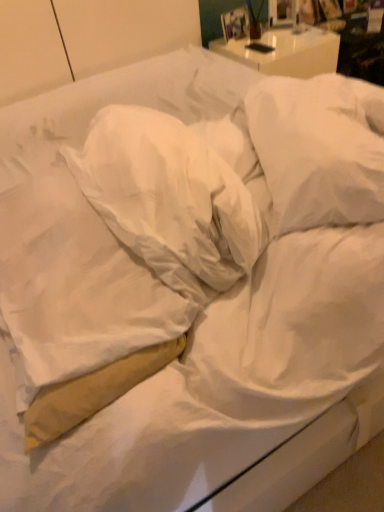
Question: Is tan fabric pillow at left, which ranks as the 1th pillow in left-to-right order, positioned far away from white soft pillow at upper right, which appears as the 1th pillow when viewed from the right?

Choices:
 (A) yes
 (B) no

Answer: (B)

Question: Is white soft pillow at upper right, which appears as the 1th pillow when viewed from the right, at the back of tan fabric pillow at left, which ranks as the 1th pillow in left-to-right order?

Choices:
 (A) no
 (B) yes

Answer: (A)

Question: Is the surface of tan fabric pillow at left, placed as the 3th pillow when sorted from right to left, in direct contact with white soft pillow at upper right, which appears as the 1th pillow when viewed from the right?

Choices:
 (A) yes
 (B) no

Answer: (B)

Question: Does tan fabric pillow at left, placed as the 3th pillow when sorted from right to left, appear on the left side of white soft pillow at upper right, which is the third pillow from left to right?

Choices:
 (A) no
 (B) yes

Answer: (B)

Question: From a real-world perspective, is tan fabric pillow at left, placed as the 3th pillow when sorted from right to left, located higher than white soft pillow at upper right, which appears as the 1th pillow when viewed from the right?

Choices:
 (A) yes
 (B) no

Answer: (B)

Question: From the image's perspective, is white soft pillow at center, which appears as the second pillow when viewed from the left, located above or below tan fabric pillow at left, which ranks as the 1th pillow in left-to-right order?

Choices:
 (A) below
 (B) above

Answer: (B)

Question: From their relative heights in the image, would you say white soft pillow at center, which appears as the second pillow when viewed from the left, is taller or shorter than tan fabric pillow at left, which ranks as the 1th pillow in left-to-right order?

Choices:
 (A) tall
 (B) short

Answer: (A)

Question: From a real-world perspective, is white soft pillow at center, the 2th pillow when ordered from right to left, above or below tan fabric pillow at left, which ranks as the 1th pillow in left-to-right order?

Choices:
 (A) below
 (B) above

Answer: (B)

Question: Which is correct: white soft pillow at center, which appears as the second pillow when viewed from the left, is inside tan fabric pillow at left, which ranks as the 1th pillow in left-to-right order, or outside of it?

Choices:
 (A) inside
 (B) outside

Answer: (B)

Question: In terms of size, does tan fabric pillow at left, which ranks as the 1th pillow in left-to-right order, appear bigger or smaller than white soft pillow at upper right, which is the third pillow from left to right?

Choices:
 (A) small
 (B) big

Answer: (B)

Question: Considering the positions of tan fabric pillow at left, which ranks as the 1th pillow in left-to-right order, and white soft pillow at upper right, which appears as the 1th pillow when viewed from the right, in the image, is tan fabric pillow at left, which ranks as the 1th pillow in left-to-right order, taller or shorter than white soft pillow at upper right, which appears as the 1th pillow when viewed from the right,?

Choices:
 (A) short
 (B) tall

Answer: (B)

Question: Based on their positions, is tan fabric pillow at left, placed as the 3th pillow when sorted from right to left, located to the left or right of white soft pillow at upper right, which appears as the 1th pillow when viewed from the right?

Choices:
 (A) left
 (B) right

Answer: (A)

Question: Is point (145, 318) positioned closer to the camera than point (362, 160)?

Choices:
 (A) closer
 (B) farther

Answer: (A)

Question: Relative to white soft pillow at upper right, which appears as the 1th pillow when viewed from the right, is white soft pillow at center, which appears as the second pillow when viewed from the left, in front or behind?

Choices:
 (A) front
 (B) behind

Answer: (A)

Question: In terms of height, does white soft pillow at center, the 2th pillow when ordered from right to left, look taller or shorter compared to white soft pillow at upper right, which appears as the 1th pillow when viewed from the right?

Choices:
 (A) tall
 (B) short

Answer: (A)